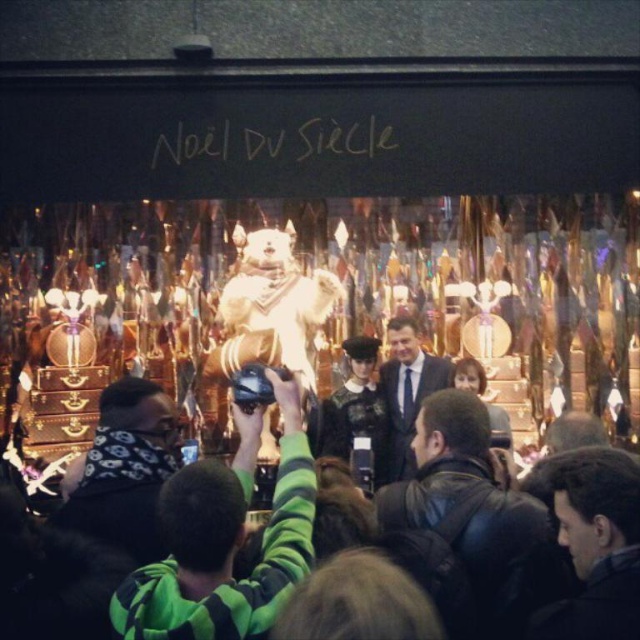
What do you see at coordinates (125, 468) in the screenshot? Image resolution: width=640 pixels, height=640 pixels. I see `dark brown leather jacket at lower left` at bounding box center [125, 468].

Does dark brown leather jacket at lower left have a greater width compared to matte black suit at center?

Yes, dark brown leather jacket at lower left is wider than matte black suit at center.

Based on the photo, who is more forward, (141, 449) or (416, 403)?

Point (141, 449) is in front.

Image resolution: width=640 pixels, height=640 pixels. What are the coordinates of `dark brown leather jacket at lower left` in the screenshot? It's located at (125, 468).

Can you confirm if leather jacket at center is shorter than dark brown leather jacket at lower left?

Incorrect, leather jacket at center's height does not fall short of dark brown leather jacket at lower left's.

Which is above, leather jacket at center or dark brown leather jacket at lower left?

dark brown leather jacket at lower left is above.

Describe the element at coordinates (464, 522) in the screenshot. I see `leather jacket at center` at that location.

Identify the location of leather jacket at center. The height and width of the screenshot is (640, 640). (464, 522).

Does green and black striped sweater at center have a greater height compared to dark brown leather jacket at lower left?

Yes, green and black striped sweater at center is taller than dark brown leather jacket at lower left.

Is green and black striped sweater at center to the right of dark brown leather jacket at lower left from the viewer's perspective?

Correct, you'll find green and black striped sweater at center to the right of dark brown leather jacket at lower left.

Is point (198, 611) positioned before point (168, 449)?

Yes, it is.

In order to click on green and black striped sweater at center in this screenshot , I will do `click(225, 540)`.